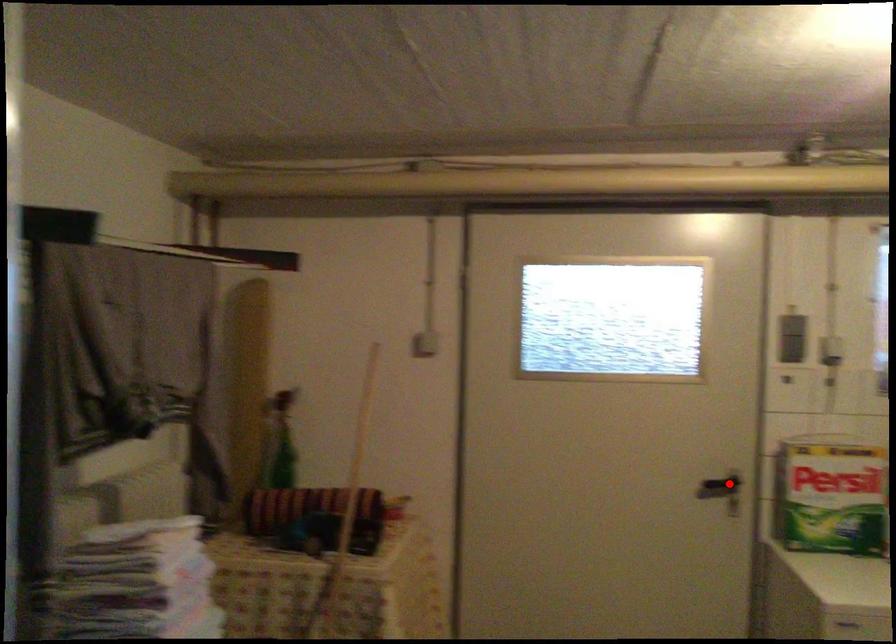
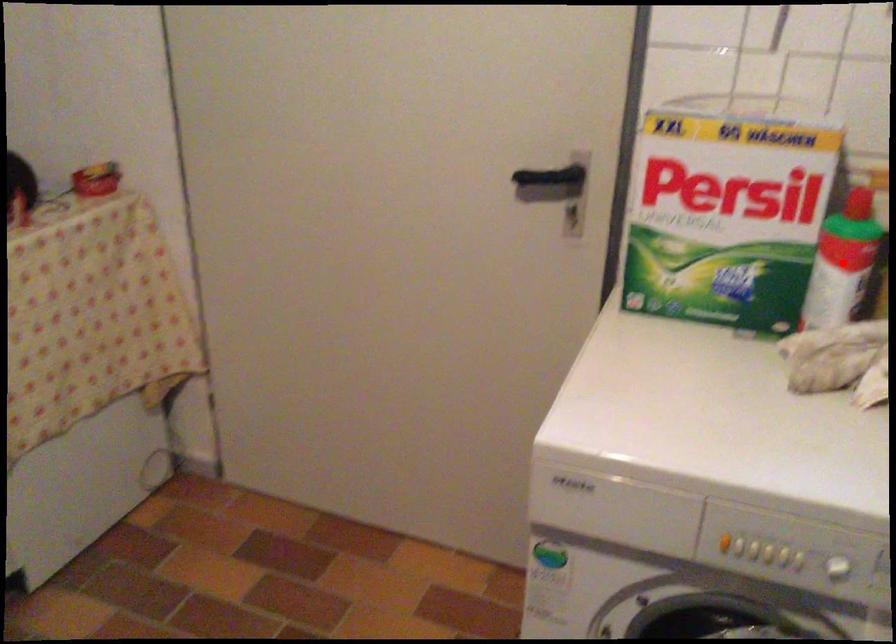
I am providing you with two images of the same scene from different viewpoints. A red point is marked on the first image and another point is marked on the second image. Does the point marked in image1 correspond to the same location as the one in image2?

No